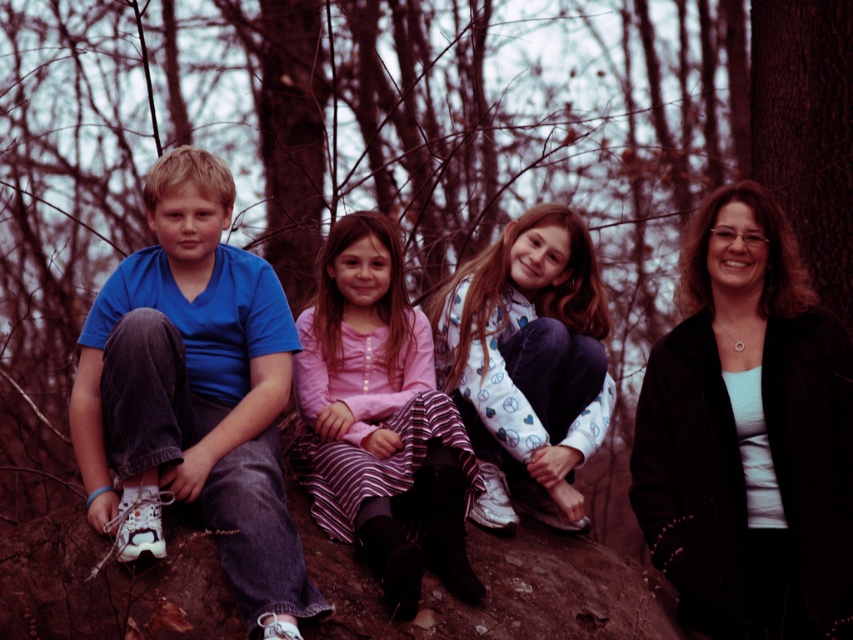
Is pink fabric dress at center above white fleece jacket at center?

Actually, pink fabric dress at center is below white fleece jacket at center.

Is pink fabric dress at center behind white fleece jacket at center?

No, pink fabric dress at center is closer to the viewer.

I want to click on pink fabric dress at center, so click(x=380, y=419).

Can you confirm if black matte jacket at upper right is bigger than matte blue t-shirt at left?

Correct, black matte jacket at upper right is larger in size than matte blue t-shirt at left.

Which is in front, point (740, 410) or point (189, 474)?

Point (189, 474) is more forward.

I want to click on black matte jacket at upper right, so click(747, 435).

Does black matte jacket at upper right come behind pink fabric dress at center?

Yes.

Which is behind, point (723, 580) or point (436, 436)?

Point (723, 580)

The image size is (853, 640). What are the coordinates of `black matte jacket at upper right` in the screenshot? It's located at (747, 435).